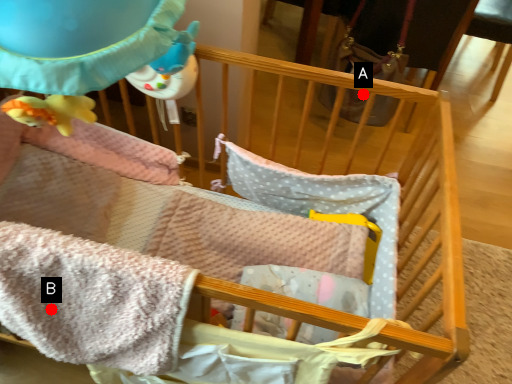
Question: Two points are circled on the image, labeled by A and B beside each circle. Which point appears farthest from the camera in this image?

Choices:
 (A) A is further
 (B) B is further

Answer: (A)